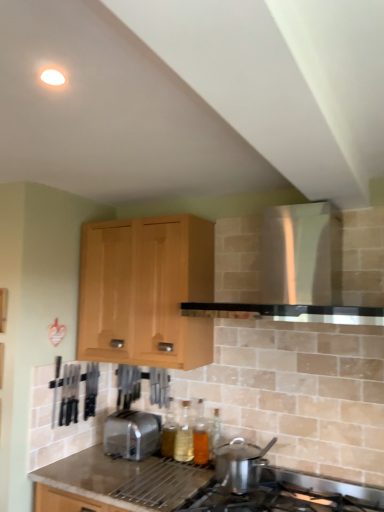
What do you see at coordinates (200, 436) in the screenshot? I see `translucent glass bottle at center, the third bottle when ordered from left to right` at bounding box center [200, 436].

Measure the distance between point (224, 499) and camera.

They are 1.89 meters apart.

The height and width of the screenshot is (512, 384). In order to click on granite gray countertop at lower center in this screenshot , I will do `click(189, 486)`.

Measure the distance between point (164, 439) and camera.

Point (164, 439) is 2.44 meters from camera.

Image resolution: width=384 pixels, height=512 pixels. Describe the element at coordinates (184, 435) in the screenshot. I see `translucent glass bottle at lower center, positioned as the second bottle in right-to-left order` at that location.

This screenshot has height=512, width=384. I want to click on translucent glass bottle at center, the third bottle when ordered from left to right, so click(x=200, y=436).

Is stainless steel pot at lower center positioned with its back to satin silver toaster at lower center?

No, stainless steel pot at lower center is not facing the opposite direction of satin silver toaster at lower center.

From the image's perspective, is stainless steel pot at lower center located above satin silver toaster at lower center?

No.

Is stainless steel pot at lower center far away from satin silver toaster at lower center?

stainless steel pot at lower center is actually quite close to satin silver toaster at lower center.

Does point (156, 333) appear closer or farther from the camera than point (171, 404)?

Point (156, 333) is positioned closer to the camera compared to point (171, 404).

Is light wood cabinet at upper center to the right of translucent glass bottle at center, the third bottle in the right-to-left sequence, from the viewer's perspective?

In fact, light wood cabinet at upper center is to the left of translucent glass bottle at center, the third bottle in the right-to-left sequence.

Looking at this image, is light wood cabinet at upper center further to camera compared to translucent glass bottle at center, the third bottle in the right-to-left sequence?

No, the depth of light wood cabinet at upper center is less than that of translucent glass bottle at center, the third bottle in the right-to-left sequence.

In the scene shown: Is light wood cabinet at upper center oriented towards translucent glass bottle at center, placed as the first bottle when sorted from left to right?

No, light wood cabinet at upper center is not facing towards translucent glass bottle at center, placed as the first bottle when sorted from left to right.

Does translucent glass bottle at center, the third bottle when ordered from left to right, appear on the left side of satin silver toaster at lower center?

No, translucent glass bottle at center, the third bottle when ordered from left to right, is not to the left of satin silver toaster at lower center.

Is the depth of translucent glass bottle at center, the third bottle when ordered from left to right, less than that of satin silver toaster at lower center?

No, translucent glass bottle at center, the third bottle when ordered from left to right, is behind satin silver toaster at lower center.

From a real-world perspective, is translucent glass bottle at center, the first bottle in the right-to-left sequence, positioned above or below satin silver toaster at lower center?

Clearly, from a real-world perspective, translucent glass bottle at center, the first bottle in the right-to-left sequence, is above satin silver toaster at lower center.

Is translucent glass bottle at center, the third bottle when ordered from left to right, aimed at satin silver toaster at lower center?

No, translucent glass bottle at center, the third bottle when ordered from left to right, does not turn towards satin silver toaster at lower center.

Considering their positions, is satin silver toaster at lower center located in front of or behind stainless steel pot at lower center?

Visually, satin silver toaster at lower center is located behind stainless steel pot at lower center.

Can we say satin silver toaster at lower center lies outside stainless steel pot at lower center?

Absolutely, satin silver toaster at lower center is external to stainless steel pot at lower center.

From the image's perspective, is satin silver toaster at lower center under stainless steel pot at lower center?

No.

Between point (150, 433) and point (281, 498), which one is positioned behind?

The point (150, 433) is more distant.

Based on the photo, considering the relative sizes of stainless steel pot at lower center and white glossy vent at upper center in the image provided, is stainless steel pot at lower center wider than white glossy vent at upper center?

Indeed, stainless steel pot at lower center has a greater width compared to white glossy vent at upper center.

From a real-world perspective, which is physically above, stainless steel pot at lower center or white glossy vent at upper center?

white glossy vent at upper center, from a real-world perspective.

Consider the image. From the image's perspective, is stainless steel pot at lower center beneath white glossy vent at upper center?

Yes.

Is granite gray countertop at lower center oriented towards satin silver toaster at lower center?

No, granite gray countertop at lower center does not turn towards satin silver toaster at lower center.

Is the position of granite gray countertop at lower center more distant than that of satin silver toaster at lower center?

No, the depth of granite gray countertop at lower center is less than that of satin silver toaster at lower center.

Does granite gray countertop at lower center have a greater height compared to satin silver toaster at lower center?

Yes.

Looking at this image, is satin silver toaster at lower center a part of granite gray countertop at lower center?

That's incorrect, satin silver toaster at lower center is not inside granite gray countertop at lower center.

Which of these two, satin silver toaster at lower center or light wood cabinet at upper center, stands taller?

light wood cabinet at upper center.

From the picture: Is satin silver toaster at lower center inside the boundaries of light wood cabinet at upper center, or outside?

satin silver toaster at lower center lies outside light wood cabinet at upper center.

Is satin silver toaster at lower center facing away from light wood cabinet at upper center?

No, light wood cabinet at upper center is not at the back of satin silver toaster at lower center.

Is satin silver toaster at lower center smaller than light wood cabinet at upper center?

Correct, satin silver toaster at lower center occupies less space than light wood cabinet at upper center.

You are a GUI agent. You are given a task and a screenshot of the screen. Output one action in this format:
    pyautogui.click(x=<x>, y=<y>)
    Task: Click on the gas stove that appears on the right of satin silver toaster at lower center
    
    Given the screenshot: What is the action you would take?
    pyautogui.click(x=274, y=499)

From a real-world perspective, count 3rd bottles downward from the light wood cabinet at upper center and point to it. Please provide its 2D coordinates.

[(169, 431)]

Estimate the real-world distances between objects in this image. Which object is further from light wood cabinet at upper center, translucent glass bottle at lower center, marked as the second bottle in a left-to-right arrangement, or translucent glass bottle at center, the first bottle in the right-to-left sequence?

Based on the image, translucent glass bottle at center, the first bottle in the right-to-left sequence, appears to be further to light wood cabinet at upper center.

Looking at this image, based on their spatial positions, is translucent glass bottle at center, the first bottle in the right-to-left sequence, or light wood cabinet at upper center closer to translucent glass bottle at center, placed as the first bottle when sorted from left to right?

The object closer to translucent glass bottle at center, placed as the first bottle when sorted from left to right, is translucent glass bottle at center, the first bottle in the right-to-left sequence.

Estimate the real-world distances between objects in this image. Which object is further from stainless steel pot at lower center, granite gray countertop at lower center or satin silver toaster at lower center?

satin silver toaster at lower center is positioned further to the anchor stainless steel pot at lower center.

Which object lies nearer to the anchor point granite gray countertop at lower center, translucent glass bottle at center, placed as the first bottle when sorted from left to right, or translucent glass bottle at center, the third bottle when ordered from left to right?

The object closer to granite gray countertop at lower center is translucent glass bottle at center, the third bottle when ordered from left to right.

When comparing their distances from translucent glass bottle at center, the first bottle in the right-to-left sequence, does satin silver toaster at lower center or stainless steel pot at lower center seem further?

stainless steel pot at lower center lies further to translucent glass bottle at center, the first bottle in the right-to-left sequence, than the other object.

When comparing their distances from stainless steel pot at lower center, does translucent glass bottle at center, the third bottle when ordered from left to right, or granite gray countertop at lower center seem closer?

granite gray countertop at lower center is closer to stainless steel pot at lower center.

Considering their positions, is stainless steel pot at lower center positioned closer to white glossy vent at upper center than translucent glass bottle at center, placed as the first bottle when sorted from left to right?

The object closer to white glossy vent at upper center is stainless steel pot at lower center.

When comparing their distances from stainless steel pot at lower center, does satin silver toaster at lower center or translucent glass bottle at lower center, marked as the second bottle in a left-to-right arrangement, seem further?

The object further to stainless steel pot at lower center is satin silver toaster at lower center.

Identify the location of toaster between stainless steel pot at lower center and translucent glass bottle at center, placed as the first bottle when sorted from left to right, from front to back. This screenshot has width=384, height=512. tap(131, 434).

Locate an element on the screen. bottle between stainless steel pot at lower center and translucent glass bottle at lower center, positioned as the second bottle in right-to-left order, in the front-back direction is located at coordinates (200, 436).

You are a GUI agent. You are given a task and a screenshot of the screen. Output one action in this format:
    pyautogui.click(x=<x>, y=<y>)
    Task: Click on the countertop positioned between stainless steel pot at lower center and satin silver toaster at lower center from near to far
    The image size is (384, 512).
    Given the screenshot: What is the action you would take?
    pyautogui.click(x=189, y=486)

You are a GUI agent. You are given a task and a screenshot of the screen. Output one action in this format:
    pyautogui.click(x=<x>, y=<y>)
    Task: Click on the bottle between white glossy vent at upper center and translucent glass bottle at lower center, positioned as the second bottle in right-to-left order, from top to bottom
    The height and width of the screenshot is (512, 384).
    Given the screenshot: What is the action you would take?
    pyautogui.click(x=200, y=436)